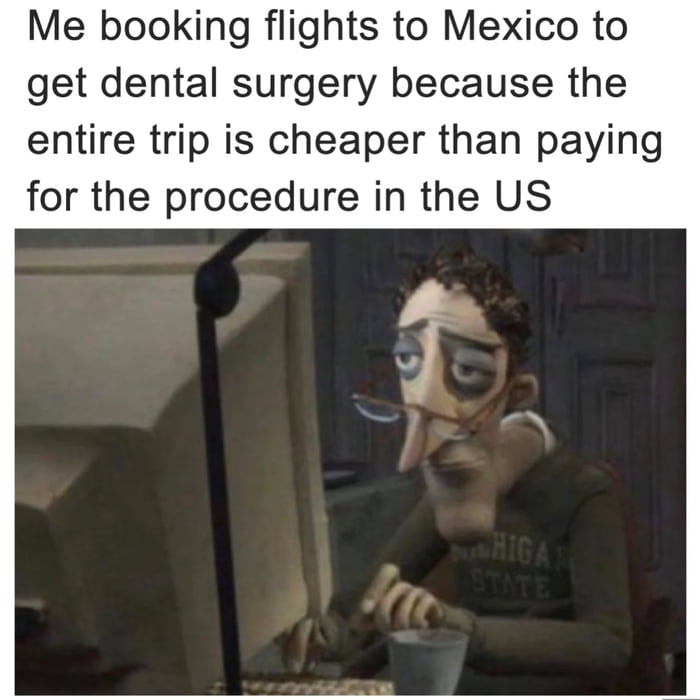
Locate an element on the screen. The image size is (700, 700). keyboard is located at coordinates (322, 682).